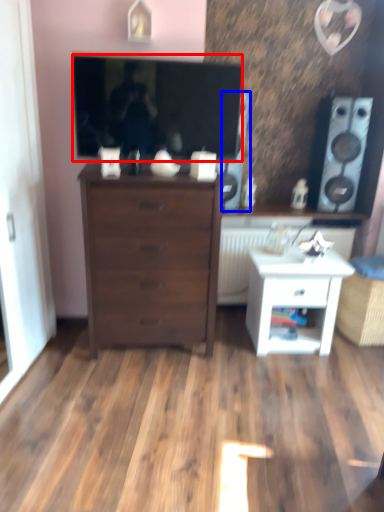
Question: Which of the following is the farthest to the observer, television (highlighted by a red box) or speaker (highlighted by a blue box)?

Choices:
 (A) television
 (B) speaker

Answer: (B)